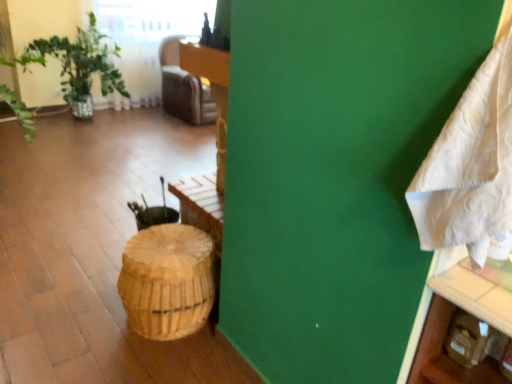
What do you see at coordinates (167, 281) in the screenshot? The width and height of the screenshot is (512, 384). I see `brown woven basket at center` at bounding box center [167, 281].

The height and width of the screenshot is (384, 512). What are the coordinates of `brown woven basket at center` in the screenshot? It's located at (167, 281).

Measure the distance between point (502, 128) and camera.

The depth of point (502, 128) is 29.69 inches.

Describe the element at coordinates (470, 165) in the screenshot. The image size is (512, 384). I see `white textured blanket at right` at that location.

You are a GUI agent. You are given a task and a screenshot of the screen. Output one action in this format:
    pyautogui.click(x=<x>, y=<y>)
    Task: Click on the white textured blanket at right
    
    Given the screenshot: What is the action you would take?
    pyautogui.click(x=470, y=165)

At what (x,y) coordinates should I click in order to perform the action: click on brown woven basket at center. Please return your answer as a coordinate pair (x, y). This screenshot has width=512, height=384. Looking at the image, I should click on (167, 281).

Consider the image. Would you say white textured blanket at right is to the left or to the right of brown woven basket at center in the picture?

Clearly, white textured blanket at right is on the right of brown woven basket at center in the image.

Does white textured blanket at right come in front of brown woven basket at center?

Yes, white textured blanket at right is closer to the viewer.

Does point (479, 158) come in front of point (164, 323)?

That is True.

From the image's perspective, between white textured blanket at right and brown woven basket at center, who is located below?

From the image's view, brown woven basket at center is below.

From a real-world perspective, which is physically below, white textured blanket at right or brown woven basket at center?

brown woven basket at center.

Which of these two, white textured blanket at right or brown woven basket at center, is thinner?

white textured blanket at right is thinner.

Considering the relative sizes of white textured blanket at right and brown woven basket at center in the image provided, is white textured blanket at right taller than brown woven basket at center?

Indeed, white textured blanket at right has a greater height compared to brown woven basket at center.

Who is smaller, white textured blanket at right or brown woven basket at center?

With smaller size is white textured blanket at right.

Would you say white textured blanket at right is inside or outside brown woven basket at center?

white textured blanket at right is spatially situated outside brown woven basket at center.

Is white textured blanket at right in contact with brown woven basket at center?

white textured blanket at right and brown woven basket at center are not in contact.

Is white textured blanket at right aimed at brown woven basket at center?

No, white textured blanket at right is not facing towards brown woven basket at center.

At what (x,y) coordinates should I click in order to perform the action: click on basket beneath the white textured blanket at right (from a real-world perspective). Please return your answer as a coordinate pair (x, y). The image size is (512, 384). Looking at the image, I should click on (167, 281).

Would you say brown woven basket at center is to the left or to the right of white textured blanket at right in the picture?

brown woven basket at center is to the left of white textured blanket at right.

Considering the relative positions of brown woven basket at center and white textured blanket at right in the image provided, is brown woven basket at center in front of white textured blanket at right?

No, brown woven basket at center is further to the viewer.

Which point is more distant from viewer, [168,268] or [447,149]?

The point [168,268] is more distant.

From the image's perspective, relative to white textured blanket at right, is brown woven basket at center above or below?

Based on their image positions, brown woven basket at center is located beneath white textured blanket at right.

From a real-world perspective, which object rests below the other?

brown woven basket at center is physically lower.

Which of these two, brown woven basket at center or white textured blanket at right, is thinner?

With smaller width is white textured blanket at right.

Can you confirm if brown woven basket at center is taller than white textured blanket at right?

In fact, brown woven basket at center may be shorter than white textured blanket at right.

Is brown woven basket at center bigger or smaller than white textured blanket at right?

Considering their sizes, brown woven basket at center takes up more space than white textured blanket at right.

Is white textured blanket at right inside brown woven basket at center?

Definitely not — white textured blanket at right is not inside brown woven basket at center.

Is brown woven basket at center not near white textured blanket at right?

Absolutely, brown woven basket at center is distant from white textured blanket at right.

Is brown woven basket at center positioned with its back to white textured blanket at right?

No, white textured blanket at right is not at the back of brown woven basket at center.

Where is `blanket above the brown woven basket at center (from a real-world perspective)`? This screenshot has height=384, width=512. blanket above the brown woven basket at center (from a real-world perspective) is located at coordinates (470, 165).

Find the location of a particular element. Image resolution: width=512 pixels, height=384 pixels. blanket above the brown woven basket at center (from a real-world perspective) is located at coordinates (470, 165).

At what (x,y) coordinates should I click in order to perform the action: click on blanket above the brown woven basket at center (from the image's perspective). Please return your answer as a coordinate pair (x, y). The width and height of the screenshot is (512, 384). Looking at the image, I should click on (470, 165).